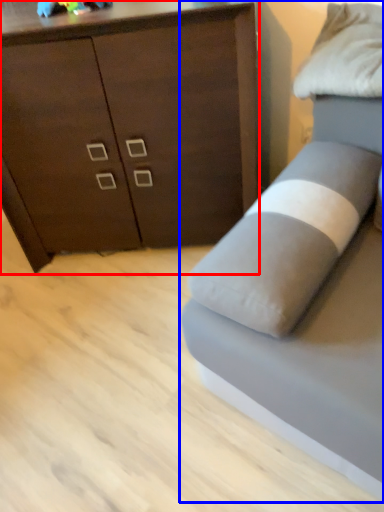
Question: Which object is closer to the camera taking this photo, chest of drawers (highlighted by a red box) or studio couch (highlighted by a blue box)?

Choices:
 (A) chest of drawers
 (B) studio couch

Answer: (B)